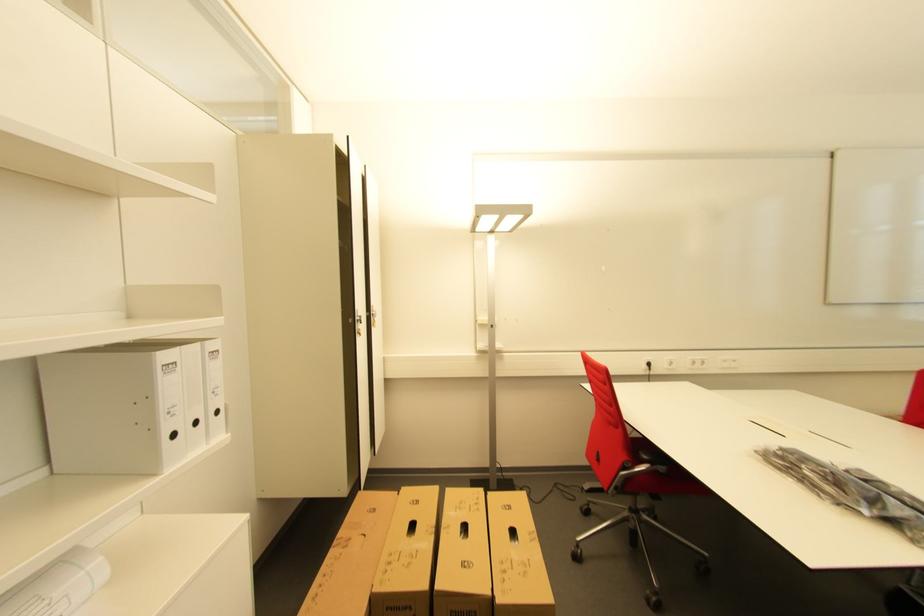
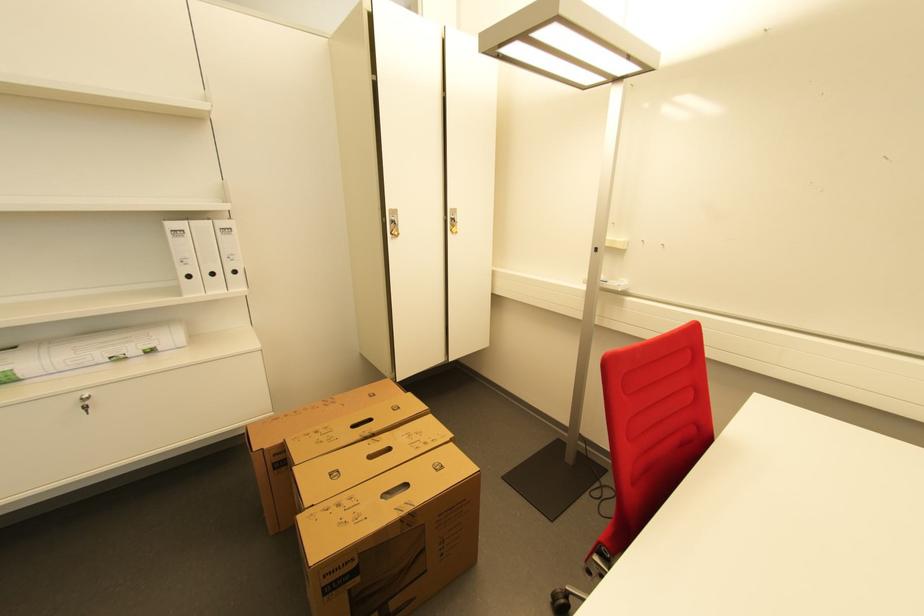
In the second image, find the point that corresponds to pixel 222 414 in the first image.

(239, 273)